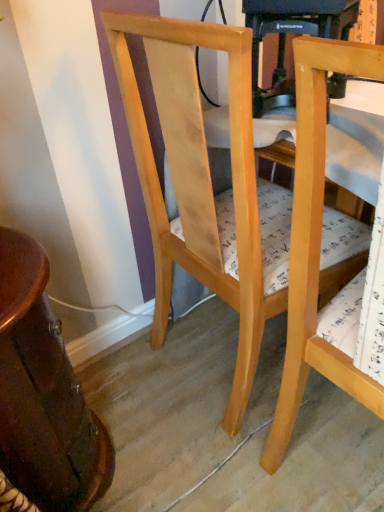
Question: Would you say light wood chair at center, which is the 1th chair in left-to-right order, is inside or outside wooden table at left?

Choices:
 (A) inside
 (B) outside

Answer: (B)

Question: Is point (162, 68) positioned closer to the camera than point (56, 426)?

Choices:
 (A) farther
 (B) closer

Answer: (B)

Question: Which object is the closest to the light wood chair at center, which is the second chair in right-to-left order?

Choices:
 (A) natural wood chair at right, acting as the second chair starting from the left
 (B) wooden table at left

Answer: (A)

Question: Based on their relative distances, which object is nearer to the natural wood chair at right, acting as the second chair starting from the left?

Choices:
 (A) light wood chair at center, which is the 1th chair in left-to-right order
 (B) wooden table at left

Answer: (A)